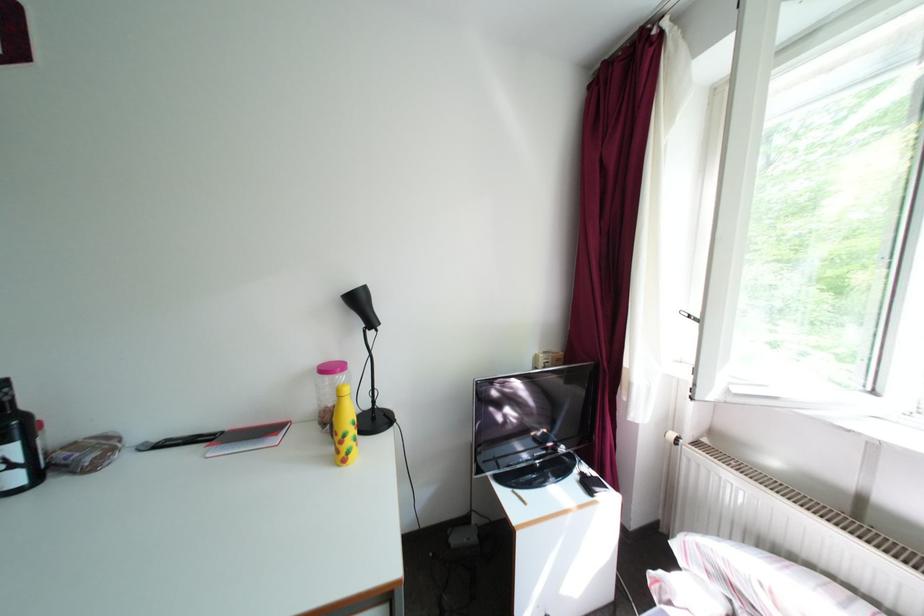
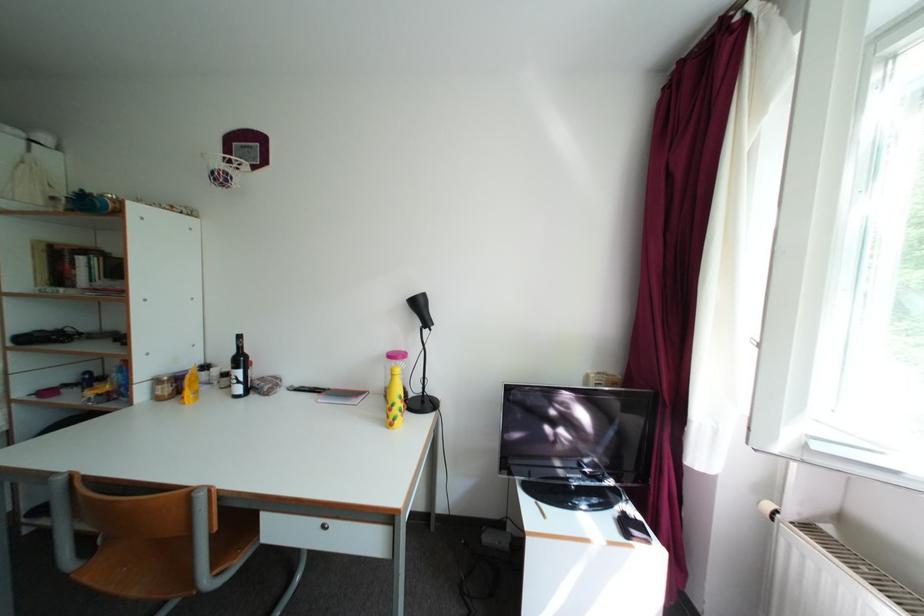
Question: Based on the continuous images, in which direction is the camera rotating? Reply with the corresponding letter.

Choices:
 (A) Left
 (B) Right
 (C) Up
 (D) Down

Answer: (A)